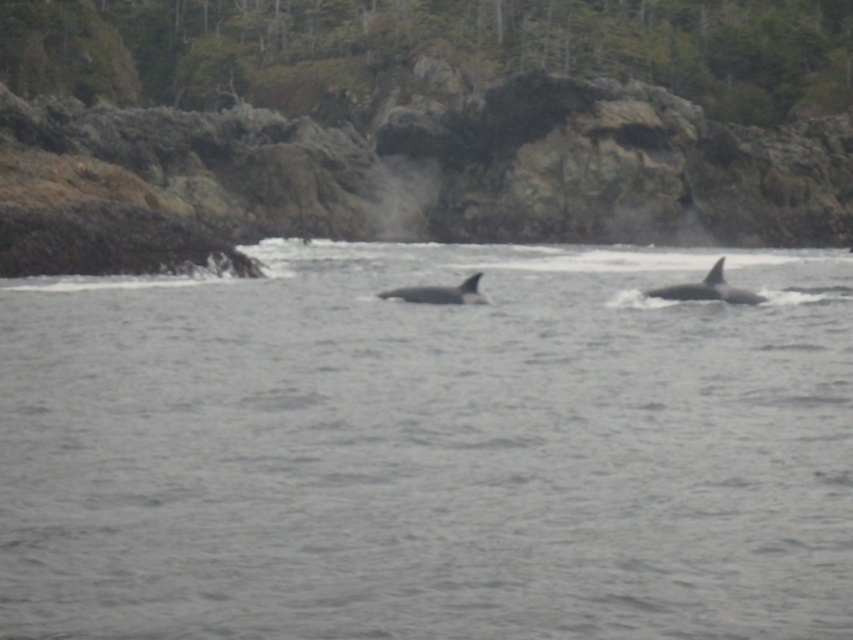
You are a marine biologist observing the coastal scene. You notice the gray water at center and the black smooth whale at right. Based on their positions in the image, which one appears taller?

The gray water at center appears taller than the black smooth whale at right.

What is the 2D coordinate of the gray water at center in the image?

The gray water at center is located at the 2D coordinate point of [428,449].